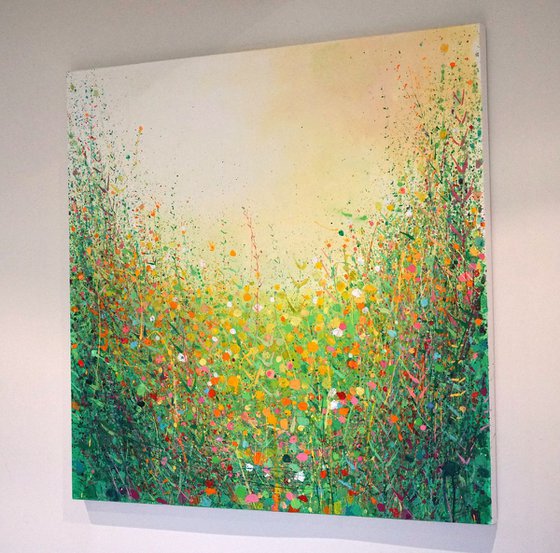
Image resolution: width=560 pixels, height=553 pixels. I want to click on clear wall above painting, so click(207, 20).